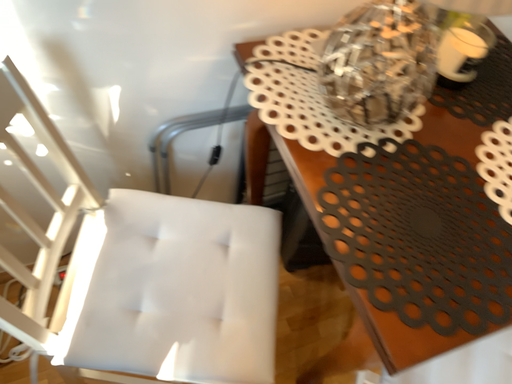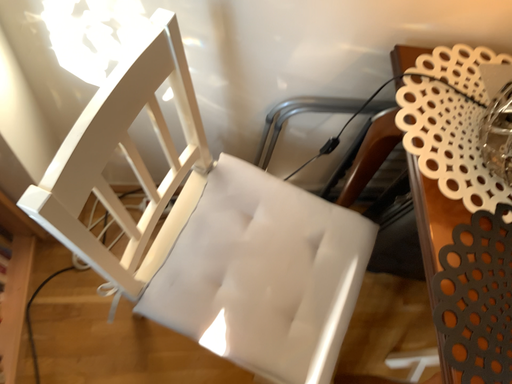
Question: Which way did the camera rotate in the video?

Choices:
 (A) rotated right
 (B) rotated left

Answer: (B)